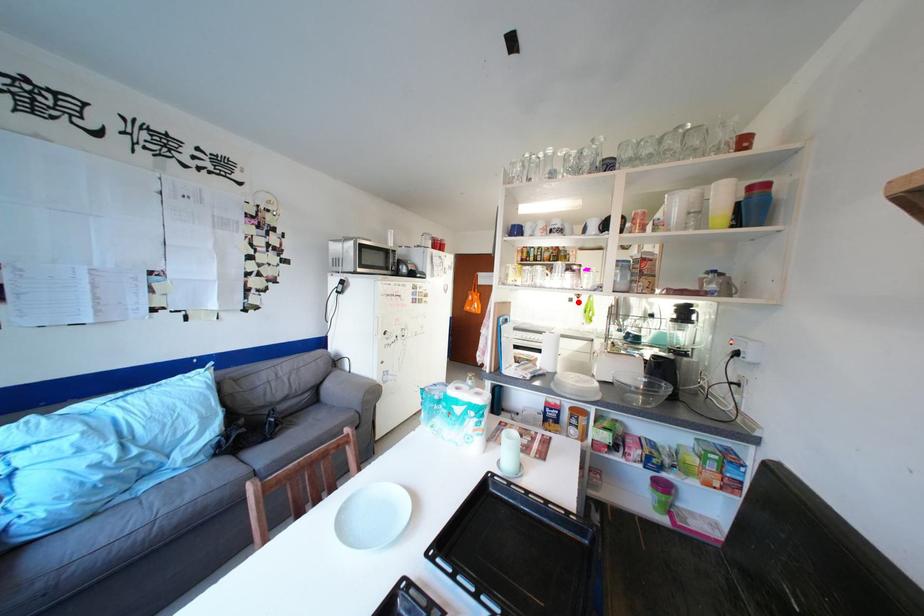
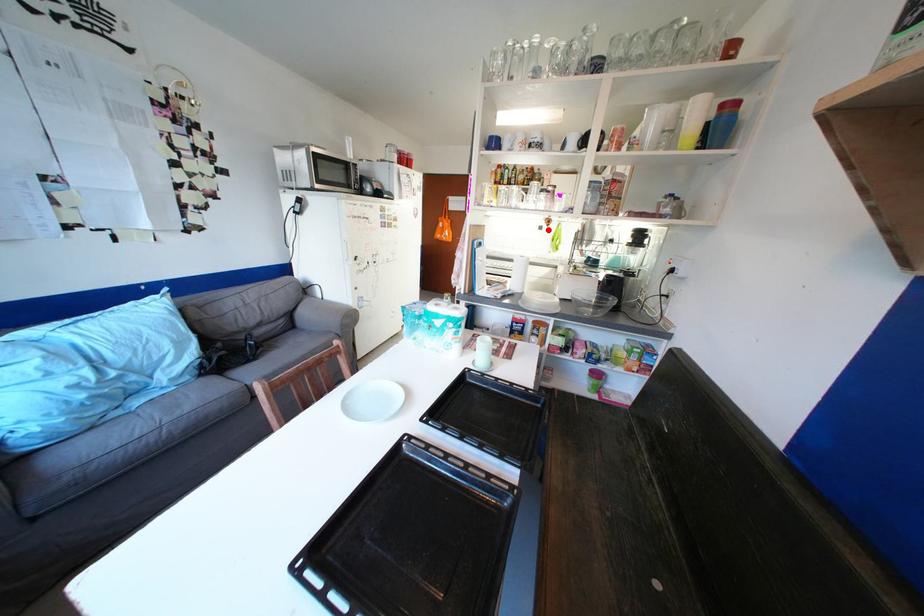
I am providing you with two images of the same scene from different viewpoints. A red point is marked on the first image and another point is marked on the second image. Does the point marked in image1 correspond to the same location as the one in image2?

Yes